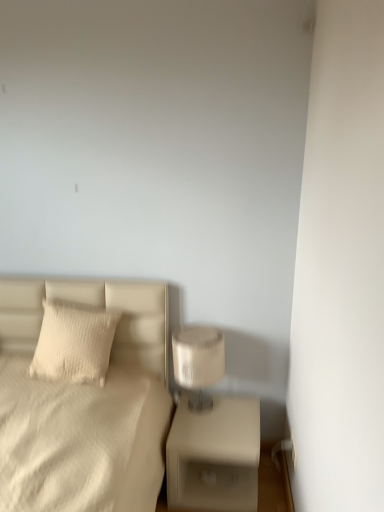
Question: Considering the positions of white textured pillow at left and beige matte nightstand at lower right in the image, is white textured pillow at left taller or shorter than beige matte nightstand at lower right?

Choices:
 (A) short
 (B) tall

Answer: (A)

Question: From a real-world perspective, is white textured pillow at left positioned above or below beige matte nightstand at lower right?

Choices:
 (A) below
 (B) above

Answer: (B)

Question: Based on their relative distances, which object is nearer to the white textured pillow at left?

Choices:
 (A) satin beige lampshade at right
 (B) white textured bed at left
 (C) beige matte nightstand at lower right

Answer: (B)

Question: Which object is the farthest from the white textured bed at left?

Choices:
 (A) white textured pillow at left
 (B) satin beige lampshade at right
 (C) beige matte nightstand at lower right

Answer: (C)